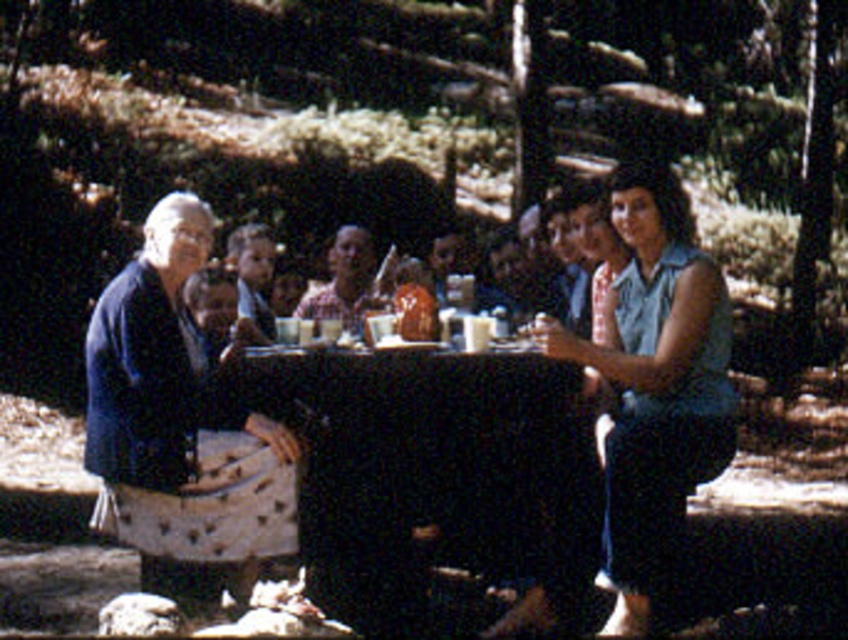
Question: Where is black glossy table at center located in relation to blue denim shirt at center in the image?

Choices:
 (A) left
 (B) right

Answer: (A)

Question: Is black glossy table at center above blue denim shirt at center?

Choices:
 (A) no
 (B) yes

Answer: (A)

Question: Which object is the farthest from the checkered fabric shirt at center?

Choices:
 (A) blue fabric dress at center
 (B) smooth brown hair at center
 (C) blue fabric shirt at left
 (D) blue denim shirt at center

Answer: (D)

Question: Among these points, which one is farthest from the camera?

Choices:
 (A) (673, 182)
 (B) (355, 253)

Answer: (B)

Question: Which object is farther from the camera taking this photo?

Choices:
 (A) checkered fabric shirt at center
 (B) blue fabric shirt at left
 (C) smooth brown hair at center
 (D) blue denim shirt at center

Answer: (A)

Question: Can you confirm if blue fabric dress at center is positioned to the right of smooth brown hair at center?

Choices:
 (A) no
 (B) yes

Answer: (B)